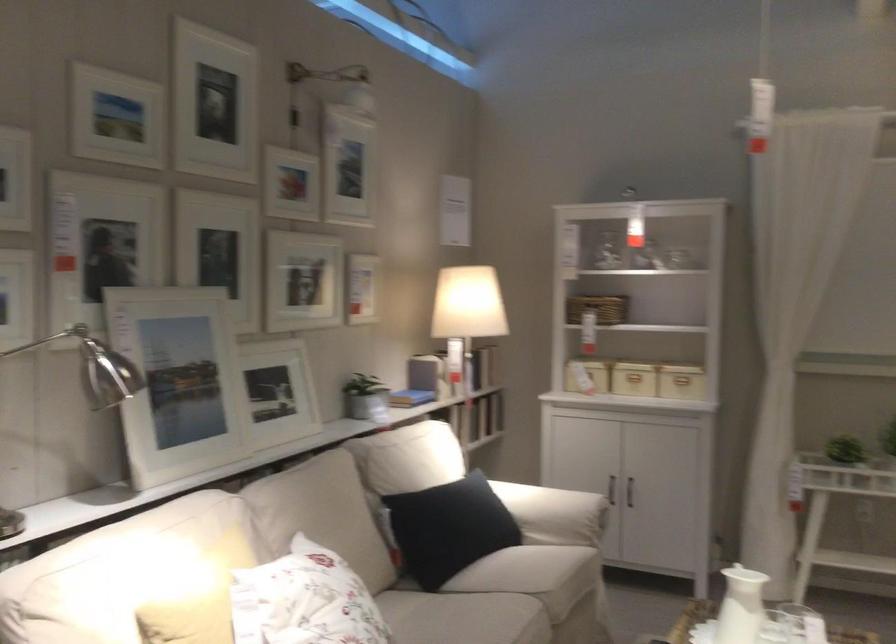
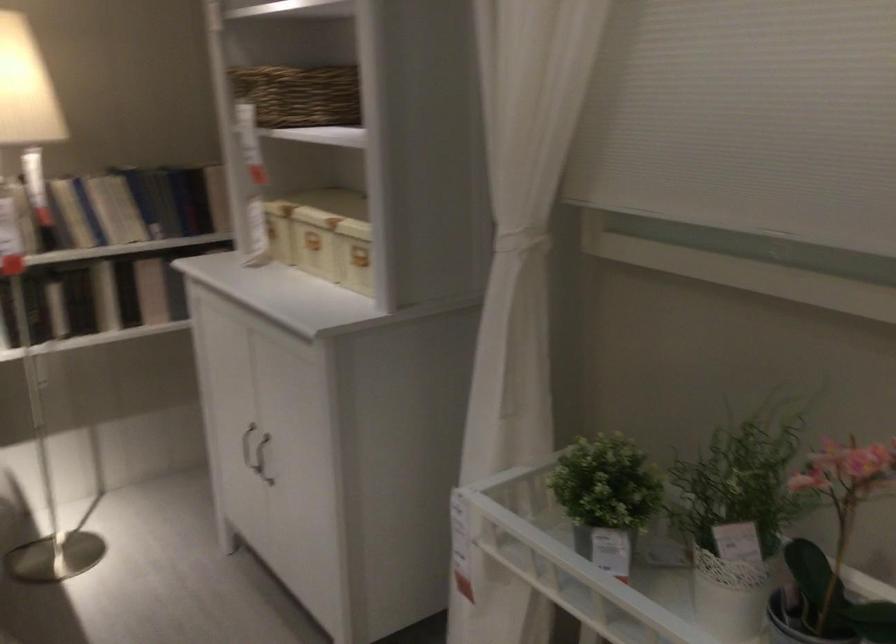
Where in the second image is the point corresponding to (x=633, y=292) from the first image?

(298, 93)